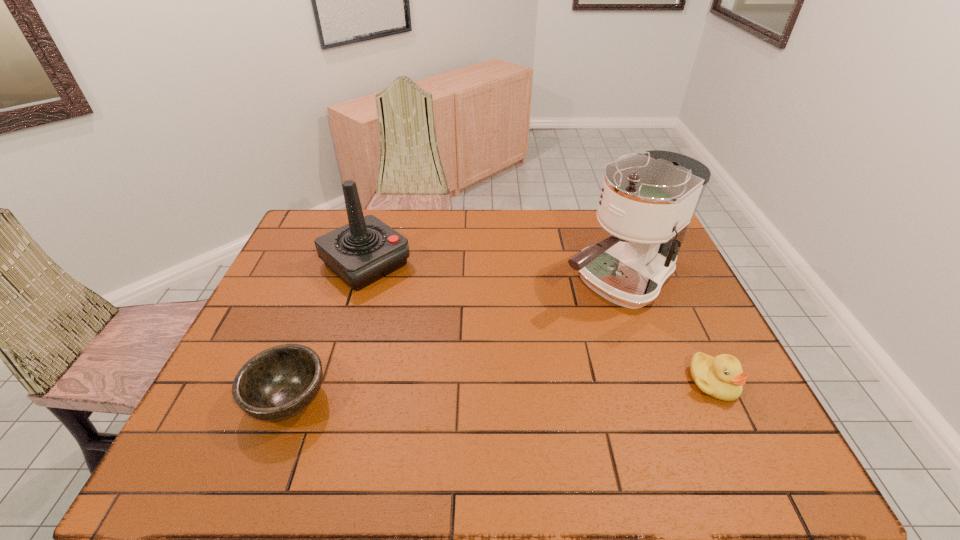
Locate an element on the screen. The width and height of the screenshot is (960, 540). free space between the third shortest object and the bowl is located at coordinates (327, 331).

The width and height of the screenshot is (960, 540). I want to click on free spot between the second tallest object and the duckling, so click(x=540, y=323).

This screenshot has height=540, width=960. What are the coordinates of `vacant space that's between the bowl and the tallest object` in the screenshot? It's located at (452, 340).

This screenshot has height=540, width=960. Identify the location of free space between the coffee maker and the third shortest object. (492, 272).

What are the coordinates of `free spot between the joystick and the duckling` in the screenshot? It's located at (540, 323).

The height and width of the screenshot is (540, 960). I want to click on vacant area that lies between the third shortest object and the shortest object, so click(x=327, y=331).

Locate an element on the screen. The width and height of the screenshot is (960, 540). vacant space in between the duckling and the coffee maker is located at coordinates (665, 331).

Find the location of `vacant area that lies between the tallest object and the joystick`. vacant area that lies between the tallest object and the joystick is located at coordinates (492, 272).

Locate which object ranks second in proximity to the tallest object. Please provide its 2D coordinates. Your answer should be formatted as a tuple, i.e. [(x, y)], where the tuple contains the x and y coordinates of a point satisfying the conditions above.

[(365, 250)]

Where is `object that stands as the closest to the duckling`? This screenshot has height=540, width=960. object that stands as the closest to the duckling is located at coordinates (647, 202).